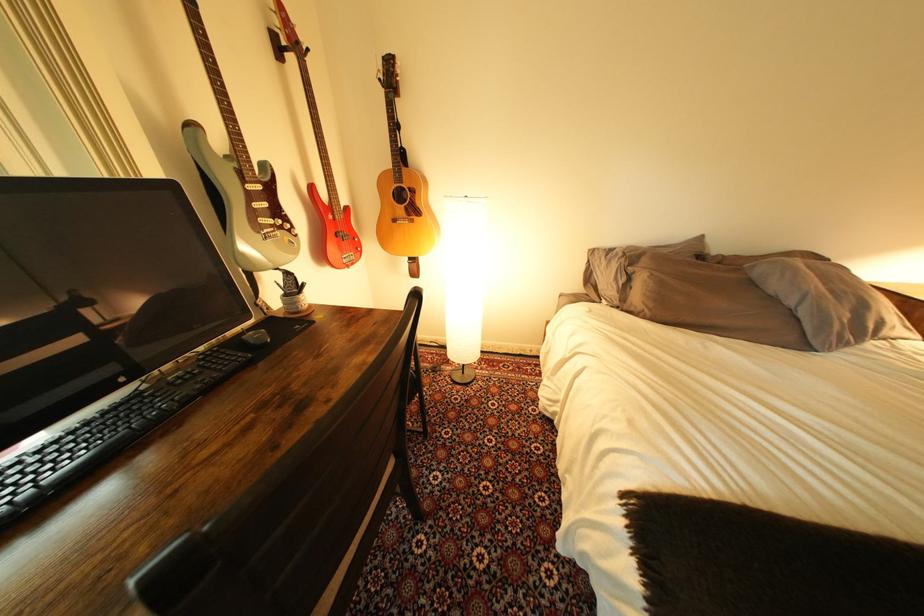
Locate an element on the screen. This screenshot has width=924, height=616. patterned pencil holder is located at coordinates (293, 294).